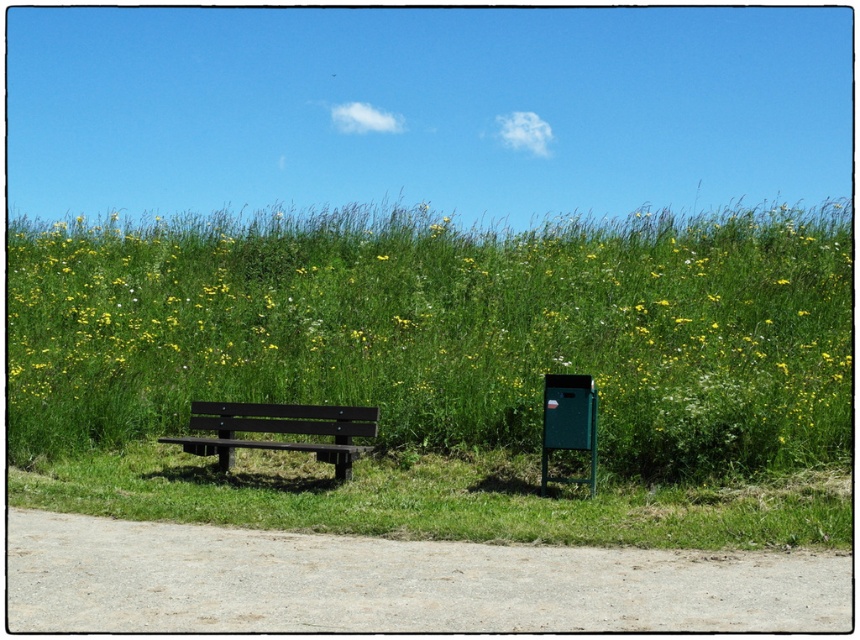
Which of these two, green grass at center or black wood bench at left, stands taller?

Standing taller between the two is green grass at center.

Which is more to the right, green grass at center or black wood bench at left?

green grass at center is more to the right.

This screenshot has height=640, width=860. What do you see at coordinates (439, 324) in the screenshot?
I see `green grass at center` at bounding box center [439, 324].

Where is `green grass at center`? green grass at center is located at coordinates (439, 324).